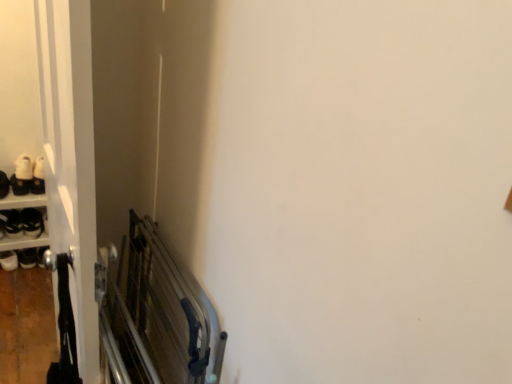
Measure the distance between point (x=23, y=155) and camera.

2.30 meters.

The image size is (512, 384). Describe the element at coordinates (22, 175) in the screenshot. I see `white matte shoe at upper left, which appears as the first footwear when viewed from the top` at that location.

The width and height of the screenshot is (512, 384). Describe the element at coordinates (55, 138) in the screenshot. I see `white glossy door at left` at that location.

I want to click on white matte shoe at left, which is the first footwear from bottom to top, so click(x=12, y=223).

Identify the location of door positioned vertically above the white matte shoe at upper left, the second footwear when ordered from bottom to top (from a real-world perspective). The width and height of the screenshot is (512, 384). (55, 138).

Considering the sizes of objects white glossy door at left and white matte shoe at upper left, the second footwear when ordered from bottom to top, in the image provided, who is taller, white glossy door at left or white matte shoe at upper left, the second footwear when ordered from bottom to top,?

white glossy door at left.

Does white glossy door at left appear on the right side of white matte shoe at upper left, which appears as the first footwear when viewed from the top?

Yes, white glossy door at left is to the right of white matte shoe at upper left, which appears as the first footwear when viewed from the top.

Is white matte shoe at left, the second footwear in the top-to-bottom sequence, next to white matte shoe at upper left, the second footwear when ordered from bottom to top?

white matte shoe at left, the second footwear in the top-to-bottom sequence, is not next to white matte shoe at upper left, the second footwear when ordered from bottom to top, and they're not touching.

In the scene shown: From a real-world perspective, relative to white matte shoe at upper left, the second footwear when ordered from bottom to top, is white matte shoe at left, which is the first footwear from bottom to top, vertically above or below?

white matte shoe at left, which is the first footwear from bottom to top, is below white matte shoe at upper left, the second footwear when ordered from bottom to top.

From the image's perspective, is white matte shoe at left, which is the first footwear from bottom to top, beneath white matte shoe at upper left, the second footwear when ordered from bottom to top?

Yes, from the image's perspective, white matte shoe at left, which is the first footwear from bottom to top, is beneath white matte shoe at upper left, the second footwear when ordered from bottom to top.

Which object is closer to the camera, white matte shoe at left, which is the first footwear from bottom to top, or white matte shoe at upper left, the second footwear when ordered from bottom to top?

white matte shoe at left, which is the first footwear from bottom to top, is closer to the camera.

Is white matte shoe at upper left, which appears as the first footwear when viewed from the top, wider than white matte shoe at left, which is the first footwear from bottom to top?

Yes, white matte shoe at upper left, which appears as the first footwear when viewed from the top, is wider than white matte shoe at left, which is the first footwear from bottom to top.

Which object is further away from the camera, white matte shoe at upper left, which appears as the first footwear when viewed from the top, or white matte shoe at left, the second footwear in the top-to-bottom sequence?

Positioned behind is white matte shoe at upper left, which appears as the first footwear when viewed from the top.

Is white matte shoe at upper left, the second footwear when ordered from bottom to top, completely or partially outside of white matte shoe at left, which is the first footwear from bottom to top?

Yes.

Who is taller, white matte shoe at upper left, the second footwear when ordered from bottom to top, or white matte shoe at left, which is the first footwear from bottom to top?

white matte shoe at left, which is the first footwear from bottom to top, is taller.

In the image, there is a white matte shoe at left, which is the first footwear from bottom to top. Where is `door below it (from the image's perspective)`? This screenshot has width=512, height=384. door below it (from the image's perspective) is located at coordinates (55, 138).

Which is more to the right, white matte shoe at left, which is the first footwear from bottom to top, or white glossy door at left?

From the viewer's perspective, white glossy door at left appears more on the right side.

Can you confirm if white matte shoe at left, which is the first footwear from bottom to top, is bigger than white glossy door at left?

Incorrect, white matte shoe at left, which is the first footwear from bottom to top, is not larger than white glossy door at left.

Are white glossy door at left and white matte shoe at left, which is the first footwear from bottom to top, far apart?

Yes, white glossy door at left and white matte shoe at left, which is the first footwear from bottom to top, are quite far apart.

In the scene shown: Which is behind, white glossy door at left or white matte shoe at left, the second footwear in the top-to-bottom sequence?

white matte shoe at left, the second footwear in the top-to-bottom sequence, is further away from the camera.

Does point (2, 42) appear closer or farther from the camera than point (17, 233)?

Point (2, 42) is positioned closer to the camera compared to point (17, 233).

Is point (22, 158) positioned in front of point (78, 24)?

No, it is behind (78, 24).

Considering the relative positions of white matte shoe at upper left, which appears as the first footwear when viewed from the top, and white glossy door at left in the image provided, is white matte shoe at upper left, which appears as the first footwear when viewed from the top, to the left or to the right of white glossy door at left?

From the image, it's evident that white matte shoe at upper left, which appears as the first footwear when viewed from the top, is to the left of white glossy door at left.

Is white matte shoe at upper left, the second footwear when ordered from bottom to top, facing towards white glossy door at left?

Yes, white matte shoe at upper left, the second footwear when ordered from bottom to top, is facing white glossy door at left.

How many degrees apart are the facing directions of white matte shoe at upper left, the second footwear when ordered from bottom to top, and white glossy door at left?

The angle between the facing direction of white matte shoe at upper left, the second footwear when ordered from bottom to top, and the facing direction of white glossy door at left is 83.4 degrees.

Locate an element on the screen. This screenshot has height=384, width=512. door that is below the white matte shoe at upper left, which appears as the first footwear when viewed from the top (from the image's perspective) is located at coordinates (55, 138).

Find the location of `footwear on the right of white matte shoe at left, the second footwear in the top-to-bottom sequence`. footwear on the right of white matte shoe at left, the second footwear in the top-to-bottom sequence is located at coordinates 22,175.

Based on their spatial positions, is white matte shoe at upper left, which appears as the first footwear when viewed from the top, or white matte shoe at left, which is the first footwear from bottom to top, closer to white glossy door at left?

The object closer to white glossy door at left is white matte shoe at upper left, which appears as the first footwear when viewed from the top.

When comparing their distances from white matte shoe at left, the second footwear in the top-to-bottom sequence, does white glossy door at left or white matte shoe at upper left, which appears as the first footwear when viewed from the top, seem closer?

white matte shoe at upper left, which appears as the first footwear when viewed from the top, is positioned closer to the anchor white matte shoe at left, the second footwear in the top-to-bottom sequence.

Estimate the real-world distances between objects in this image. Which object is further from white matte shoe at upper left, which appears as the first footwear when viewed from the top, white glossy door at left or white matte shoe at left, the second footwear in the top-to-bottom sequence?

white glossy door at left lies further to white matte shoe at upper left, which appears as the first footwear when viewed from the top, than the other object.

From the image, which object appears to be farther from white matte shoe at left, the second footwear in the top-to-bottom sequence, white matte shoe at upper left, which appears as the first footwear when viewed from the top, or white glossy door at left?

white glossy door at left is further to white matte shoe at left, the second footwear in the top-to-bottom sequence.

When comparing their distances from white glossy door at left, does white matte shoe at left, the second footwear in the top-to-bottom sequence, or white matte shoe at upper left, the second footwear when ordered from bottom to top, seem closer?

Among the two, white matte shoe at upper left, the second footwear when ordered from bottom to top, is located nearer to white glossy door at left.

When comparing their distances from white matte shoe at upper left, the second footwear when ordered from bottom to top, does white matte shoe at left, the second footwear in the top-to-bottom sequence, or white glossy door at left seem further?

The object further to white matte shoe at upper left, the second footwear when ordered from bottom to top, is white glossy door at left.

This screenshot has width=512, height=384. What are the coordinates of `footwear between white glossy door at left and white matte shoe at upper left, the second footwear when ordered from bottom to top, from front to back` in the screenshot? It's located at (12, 223).